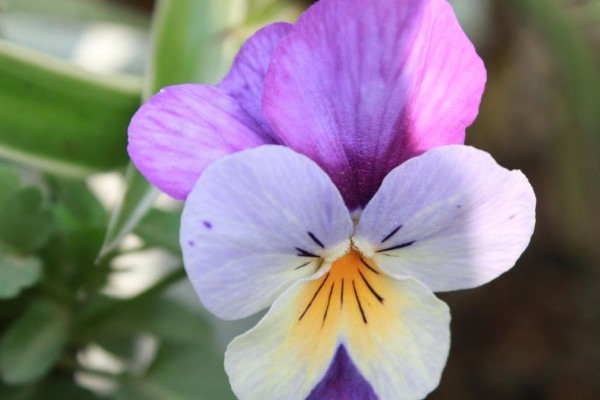
Find the location of a particular element. green plant is located at coordinates (81, 315).